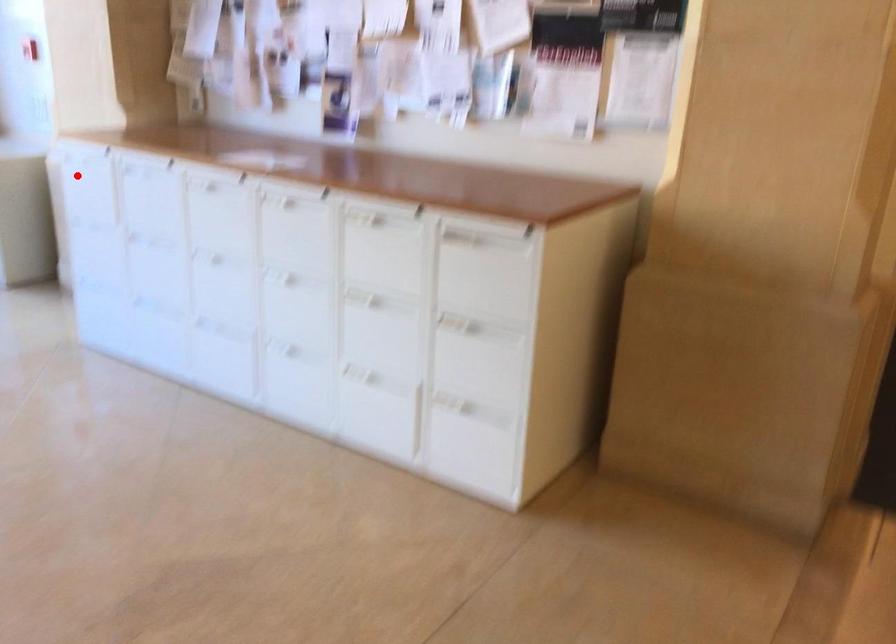
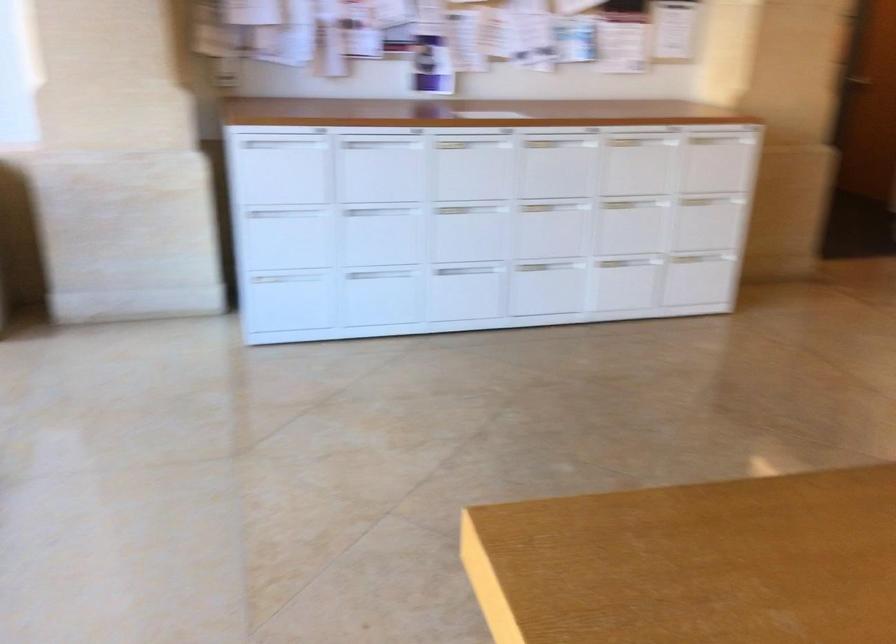
Where in the second image is the point corresponding to the highlighted location from the first image?

(280, 167)